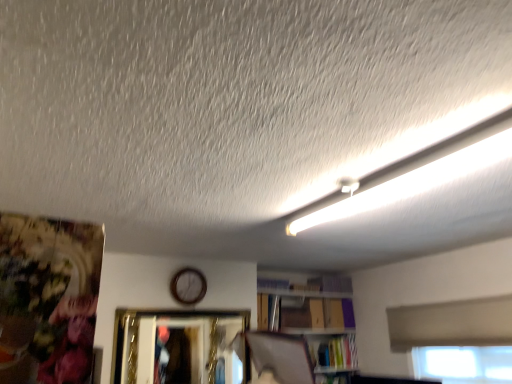
Question: From a real-world perspective, is gold metallic picture frame at center positioned over hardcover book at lower right based on gravity?

Choices:
 (A) yes
 (B) no

Answer: (A)

Question: Does gold metallic picture frame at center have a lesser height compared to hardcover book at lower right?

Choices:
 (A) yes
 (B) no

Answer: (B)

Question: Does gold metallic picture frame at center turn towards hardcover book at lower right?

Choices:
 (A) no
 (B) yes

Answer: (A)

Question: Does gold metallic picture frame at center come in front of hardcover book at lower right?

Choices:
 (A) yes
 (B) no

Answer: (A)

Question: Is gold metallic picture frame at center taller than hardcover book at lower right?

Choices:
 (A) yes
 (B) no

Answer: (A)

Question: Based on their sizes in the image, would you say white fluorescent tube at upper right is bigger or smaller than hardcover book at lower right?

Choices:
 (A) small
 (B) big

Answer: (A)

Question: Is white fluorescent tube at upper right wider or thinner than hardcover book at lower right?

Choices:
 (A) thin
 (B) wide

Answer: (A)

Question: Choose the correct answer: Is white fluorescent tube at upper right inside hardcover book at lower right or outside it?

Choices:
 (A) inside
 (B) outside

Answer: (B)

Question: From their relative heights in the image, would you say white fluorescent tube at upper right is taller or shorter than hardcover book at lower right?

Choices:
 (A) short
 (B) tall

Answer: (A)

Question: Is gold metallic picture frame at center in front of or behind white fluorescent tube at upper right in the image?

Choices:
 (A) behind
 (B) front

Answer: (A)

Question: From the image's perspective, is gold metallic picture frame at center located above or below white fluorescent tube at upper right?

Choices:
 (A) above
 (B) below

Answer: (B)

Question: Looking at their shapes, would you say gold metallic picture frame at center is wider or thinner than white fluorescent tube at upper right?

Choices:
 (A) thin
 (B) wide

Answer: (A)

Question: In the image, is gold metallic picture frame at center on the left side or the right side of white fluorescent tube at upper right?

Choices:
 (A) right
 (B) left

Answer: (B)

Question: Is wooden clock at center taller or shorter than hardcover book at lower right?

Choices:
 (A) short
 (B) tall

Answer: (B)

Question: From the image's perspective, is wooden clock at center above or below hardcover book at lower right?

Choices:
 (A) below
 (B) above

Answer: (B)